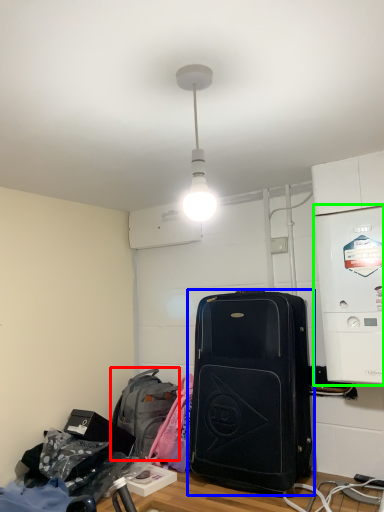
Question: Based on their relative distances, which object is nearer to backpack (highlighted by a red box)? Choose from luggage and bags (highlighted by a blue box) and appliance (highlighted by a green box).

Choices:
 (A) luggage and bags
 (B) appliance

Answer: (A)